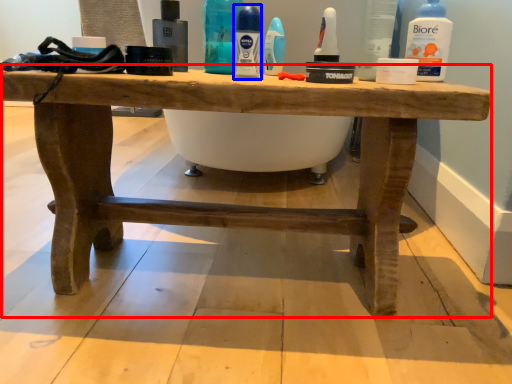
Question: Which object is further to the camera taking this photo, table (highlighted by a red box) or mouthwash (highlighted by a blue box)?

Choices:
 (A) table
 (B) mouthwash

Answer: (B)